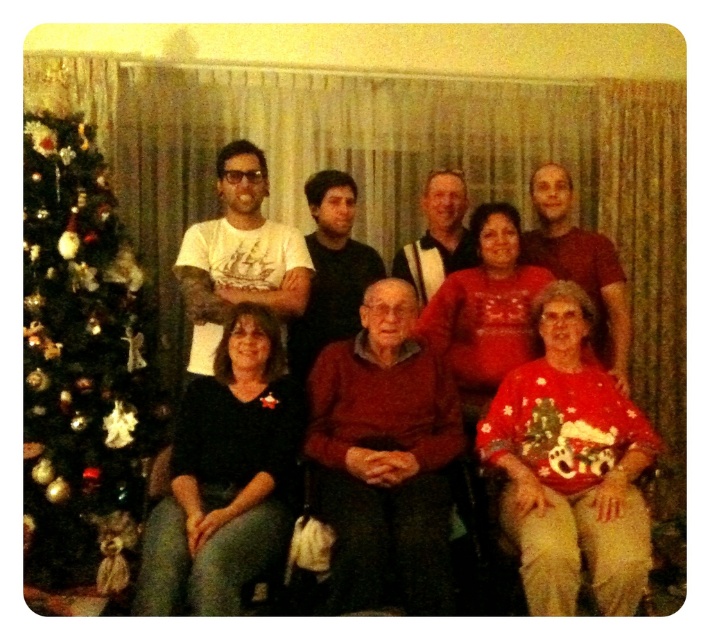
Based on the photo, you are standing in the room where the festive photo is taken. The photographer wants to ensure the green shiny christmas tree at left is centered in the frame. Based on its current position at point 0.572, 0.114, which direction should you move to center it?

To center the green shiny christmas tree at left, you should move it towards the left and upwards since its current coordinates are 0.572 on the x and 0.114 on the y axis. The center of the frame is at 0.5, so moving left reduces the x value and moving up increases the y value to reach the center.

You are a photographer setting up for a group photo. You notice the green shiny christmas tree at left and the red sweater at center. Which object should you focus on first if you want to capture both in the same frame without moving the camera?

The green shiny christmas tree at left is smaller than the red sweater at center, so you should focus on the red sweater at center first since it is larger and more prominent in the scene.

You are a photographer trying to capture a clear shot of both the green shiny christmas tree at left and the red sweater at center. Which object will appear larger in the photo due to its proximity to the camera?

The green shiny christmas tree at left will appear larger in the photo because it is closer to the viewer than the red sweater at center.